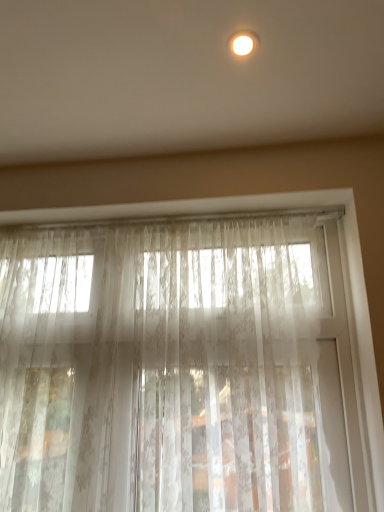
Question: Is sheer white lace curtain at center further to camera compared to matte white light fixture at upper center?

Choices:
 (A) yes
 (B) no

Answer: (A)

Question: Is sheer white lace curtain at center oriented towards matte white light fixture at upper center?

Choices:
 (A) no
 (B) yes

Answer: (B)

Question: Is sheer white lace curtain at center thinner than matte white light fixture at upper center?

Choices:
 (A) yes
 (B) no

Answer: (A)

Question: From the image's perspective, does sheer white lace curtain at center appear higher than matte white light fixture at upper center?

Choices:
 (A) yes
 (B) no

Answer: (B)

Question: Is sheer white lace curtain at center outside of matte white light fixture at upper center?

Choices:
 (A) yes
 (B) no

Answer: (A)

Question: Is sheer white lace curtain at center to the right of matte white light fixture at upper center from the viewer's perspective?

Choices:
 (A) yes
 (B) no

Answer: (B)

Question: Is matte white light fixture at upper center not near sheer white lace curtain at center?

Choices:
 (A) yes
 (B) no

Answer: (B)

Question: Is matte white light fixture at upper center at the left side of sheer white lace curtain at center?

Choices:
 (A) no
 (B) yes

Answer: (A)

Question: Does matte white light fixture at upper center have a larger size compared to sheer white lace curtain at center?

Choices:
 (A) no
 (B) yes

Answer: (A)

Question: Does matte white light fixture at upper center turn towards sheer white lace curtain at center?

Choices:
 (A) no
 (B) yes

Answer: (A)

Question: From a real-world perspective, is matte white light fixture at upper center over sheer white lace curtain at center?

Choices:
 (A) yes
 (B) no

Answer: (A)

Question: Considering the relative positions of matte white light fixture at upper center and sheer white lace curtain at center in the image provided, is matte white light fixture at upper center to the right of sheer white lace curtain at center from the viewer's perspective?

Choices:
 (A) yes
 (B) no

Answer: (A)

Question: From the image's perspective, is sheer white lace curtain at center positioned above or below matte white light fixture at upper center?

Choices:
 (A) below
 (B) above

Answer: (A)